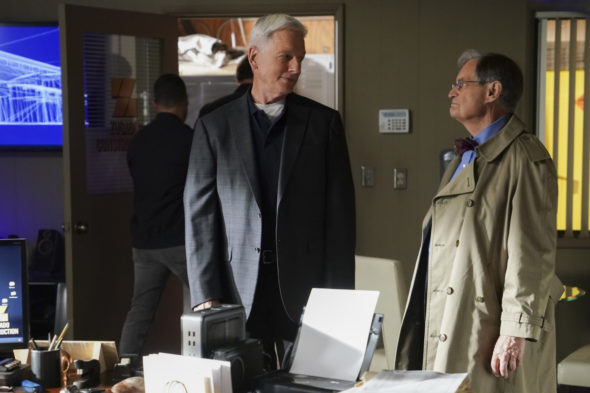
Where is `monitor`? monitor is located at coordinates (16, 260).